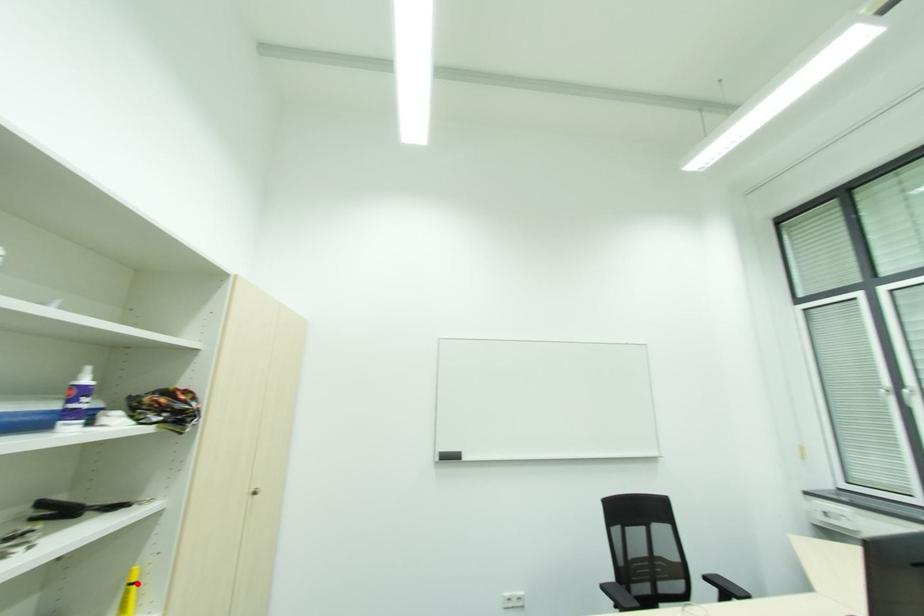
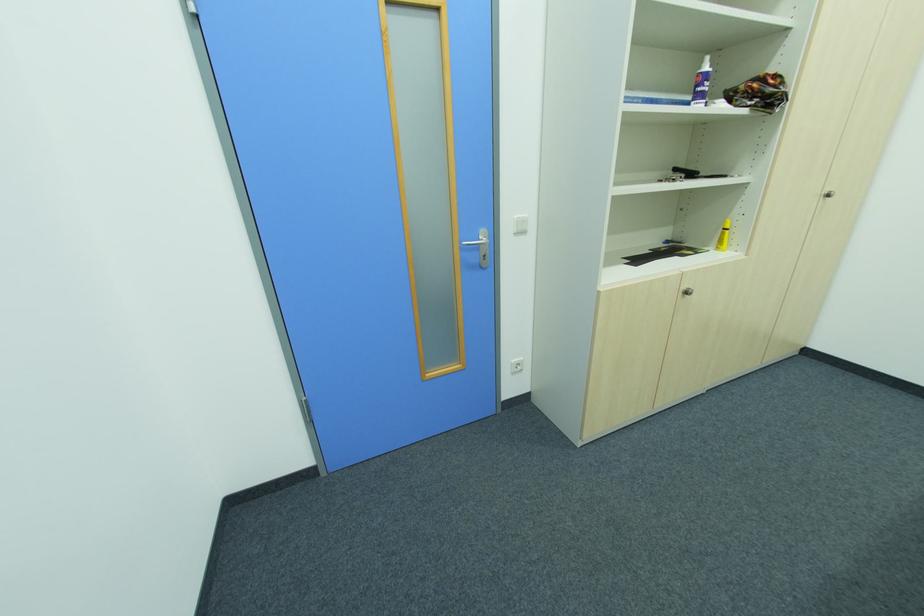
Question: I am providing you with two images of the same scene from different viewpoints. A red point is shown in image1. For the corresponding object point in image2, is it positioned nearer or farther from the camera?

Choices:
 (A) Nearer
 (B) Farther

Answer: (B)